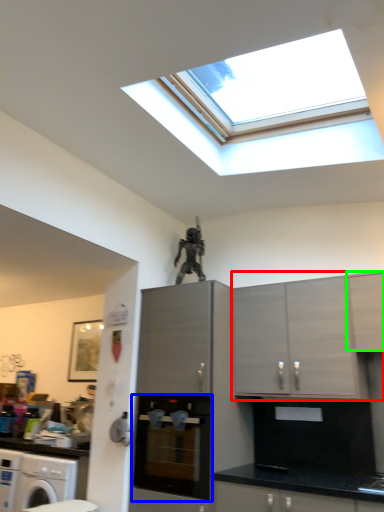
Question: Considering the real-world distances, which object is farthest from cabinetry (highlighted by a red box)? home appliance (highlighted by a blue box) or cabinetry (highlighted by a green box)?

Choices:
 (A) home appliance
 (B) cabinetry

Answer: (A)